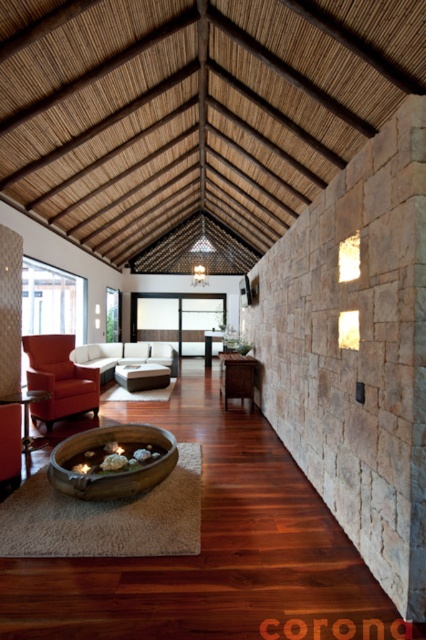
Which is more to the right, brown wooden fire pit at center or matte orange armchair at left?

Positioned to the right is brown wooden fire pit at center.

Is point (92, 444) positioned after point (63, 378)?

No.

Is point (144, 474) positioned after point (25, 337)?

No.

Find the location of a particular element. This screenshot has width=426, height=640. brown wooden fire pit at center is located at coordinates (112, 468).

Is matte orange armchair at left positioned at the back of matte gray ottoman at center?

That is False.

Who is positioned more to the right, matte orange armchair at left or matte gray ottoman at center?

From the viewer's perspective, matte gray ottoman at center appears more on the right side.

I want to click on matte orange armchair at left, so click(58, 378).

Where is `matte orange armchair at left`? matte orange armchair at left is located at coordinates (58, 378).

Does brown wooden fire pit at center appear over brown wood cabinet at center?

Actually, brown wooden fire pit at center is below brown wood cabinet at center.

Can you confirm if brown wooden fire pit at center is bigger than brown wood cabinet at center?

Yes.

Between point (69, 492) and point (249, 362), which one is positioned in front?

Point (69, 492) is more forward.

This screenshot has width=426, height=640. I want to click on brown wooden fire pit at center, so click(112, 468).